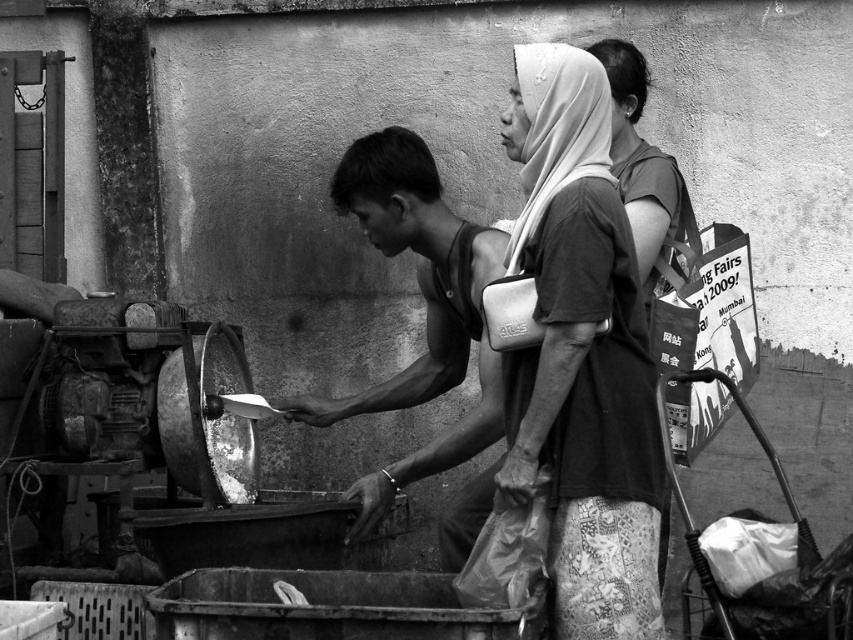
Is matte black purse at center to the left of matte black headscarf at upper right from the viewer's perspective?

Indeed, matte black purse at center is positioned on the left side of matte black headscarf at upper right.

Who is taller, matte black purse at center or matte black headscarf at upper right?

With more height is matte black headscarf at upper right.

This screenshot has height=640, width=853. What do you see at coordinates (581, 355) in the screenshot?
I see `matte black purse at center` at bounding box center [581, 355].

Locate an element on the screen. matte black purse at center is located at coordinates (581, 355).

Does matte black headscarf at upper right have a greater height compared to smooth skin man at center?

Yes.

Which is behind, point (614, 397) or point (349, 413)?

The point (349, 413) is more distant.

Is point (560, 541) positioned after point (381, 500)?

No, it is not.

Where is `matte black headscarf at upper right`? The image size is (853, 640). matte black headscarf at upper right is located at coordinates [x=582, y=355].

Consider the image. Is matte black purse at center wider than smooth skin man at center?

Yes.

Can you confirm if matte black purse at center is bigger than smooth skin man at center?

Indeed, matte black purse at center has a larger size compared to smooth skin man at center.

Locate an element on the screen. The image size is (853, 640). matte black purse at center is located at coordinates (581, 355).

This screenshot has height=640, width=853. I want to click on matte black purse at center, so click(581, 355).